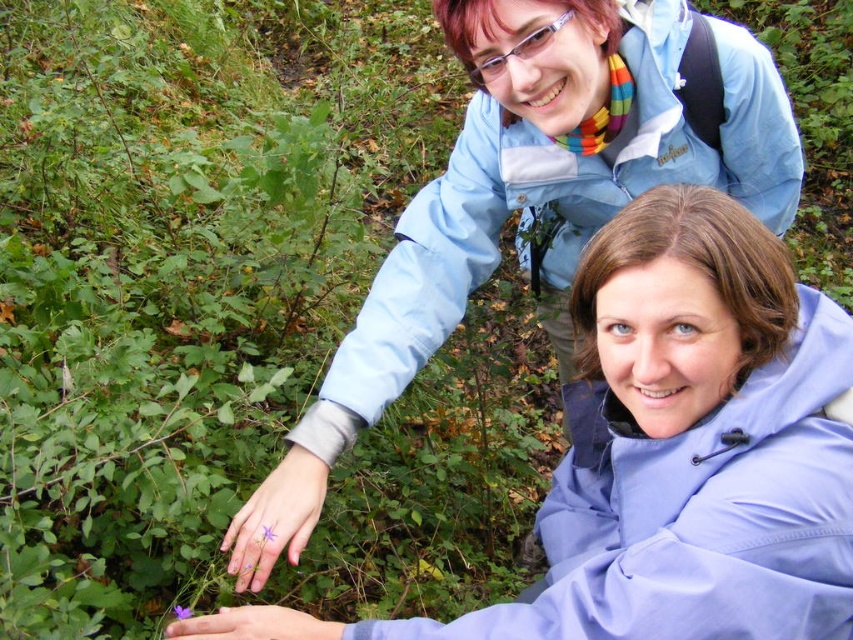
You are a photographer standing 30 inches away from the camera. You want to take a photo of the matte blue jacket at upper center. Can you adjust your position to be exactly at the recommended distance of 30.65 inches to capture it perfectly?

The matte blue jacket at upper center is currently 30.65 inches away from the camera. Since you are already 30 inches away, you need to move an additional 0.65 inches closer to reach the exact recommended distance.

You are a fashion designer observing two jackets in an image. The first is a matte blue jacket at upper center, and the second is a light blue fabric jacket at upper center. Which jacket has a thinner material?

The matte blue jacket at upper center is thinner than the light blue fabric jacket at upper center.

You are taking a photo of two people in a forest. The first person is at point (602,282) and the second person is at point (753,113). Which person is closer to the camera?

The person at point (602,282) is closer to the camera than the person at point (753,113).